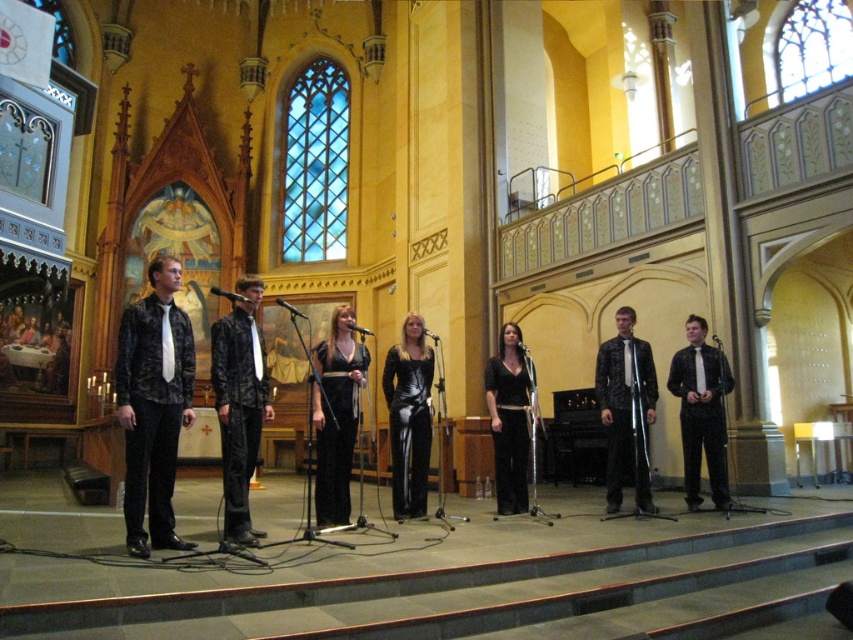
Question: Can you confirm if shiny black suit at center is positioned to the right of black leather dress at center?

Choices:
 (A) yes
 (B) no

Answer: (A)

Question: Which point is farther to the camera?

Choices:
 (A) black textured shirt at right
 (B) shiny black suit at center
 (C) black leather dress at center
 (D) black textured jacket at center

Answer: (A)

Question: Estimate the real-world distances between objects in this image. Which object is closer to the black textured shirt at right?

Choices:
 (A) black textured jacket at center
 (B) black satin dress at center
 (C) black velvet dress at center

Answer: (C)

Question: Which of the following is the farthest from the observer?

Choices:
 (A) (152, 481)
 (B) (392, 419)

Answer: (B)

Question: Does black textured jacket at center appear on the right side of black textured shirt at right?

Choices:
 (A) yes
 (B) no

Answer: (B)

Question: Can you confirm if black textured jacket at center is smaller than shiny black suit at center?

Choices:
 (A) no
 (B) yes

Answer: (A)